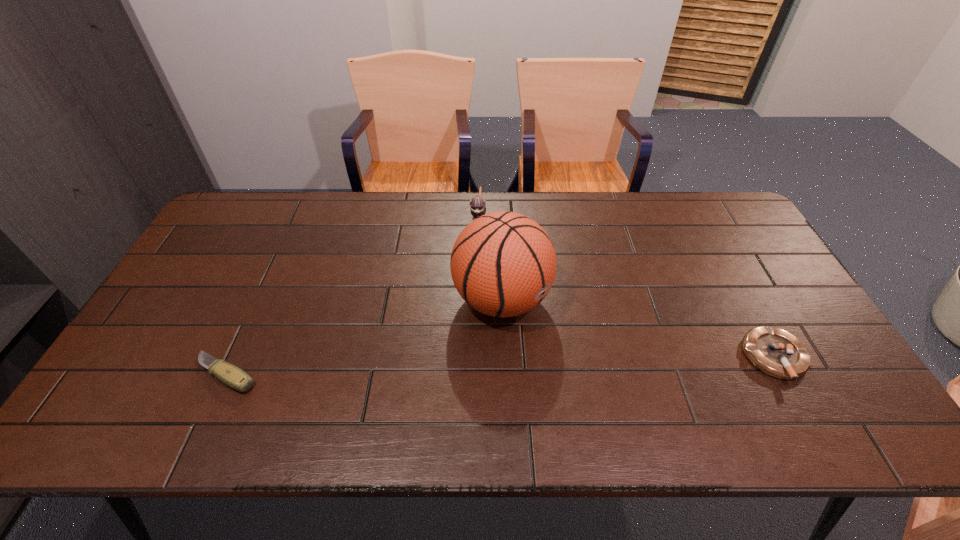
Locate an element on the screen. empty space that is in between the ashtray and the leftmost object is located at coordinates (501, 366).

Where is `vacant region between the rightmost object and the farthest object`? vacant region between the rightmost object and the farthest object is located at coordinates (627, 286).

Identify the location of object that is the third closest one to the leftmost object. (777, 353).

This screenshot has width=960, height=540. What are the coordinates of `object that is the third closest to the kitten` in the screenshot? It's located at (777, 353).

The image size is (960, 540). Find the location of `vacant space that satisfies the following two spatial constraints: 1. on the back side of the rightmost object; 2. on the left side of the shortest object`. vacant space that satisfies the following two spatial constraints: 1. on the back side of the rightmost object; 2. on the left side of the shortest object is located at coordinates (235, 357).

I want to click on vacant point that satisfies the following two spatial constraints: 1. on the back side of the basketball; 2. on the left side of the shortest object, so click(261, 299).

Locate an element on the screen. vacant region that satisfies the following two spatial constraints: 1. on the back side of the second tallest object; 2. on the right side of the shortest object is located at coordinates (300, 216).

Where is `vacant space that satisfies the following two spatial constraints: 1. on the back side of the leftmost object; 2. on the right side of the tallest object`? vacant space that satisfies the following two spatial constraints: 1. on the back side of the leftmost object; 2. on the right side of the tallest object is located at coordinates (261, 299).